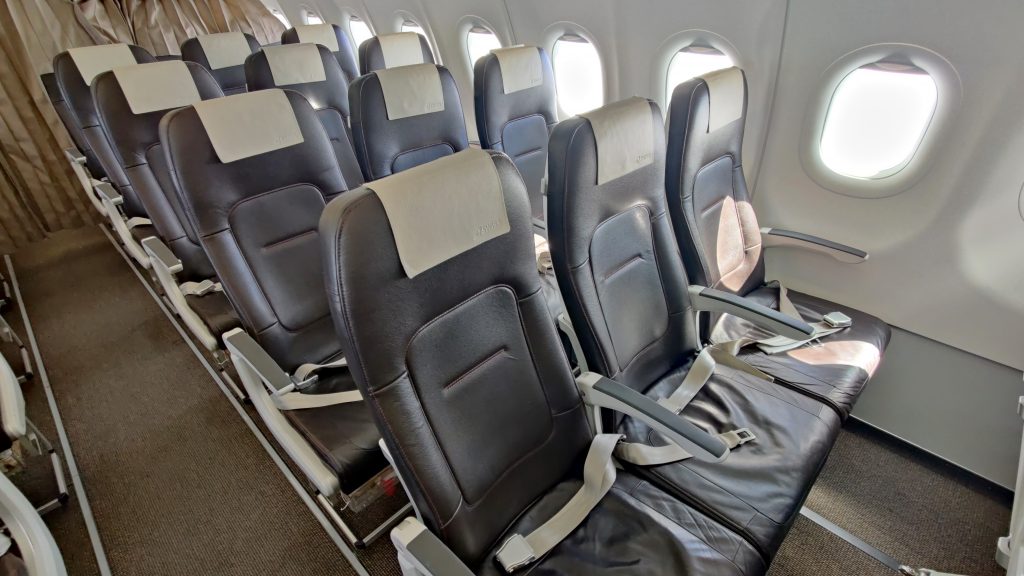
The height and width of the screenshot is (576, 1024). I want to click on window, so click(888, 134), click(686, 65), click(584, 64), click(472, 53), click(416, 30), click(362, 26), click(319, 25), click(279, 18).